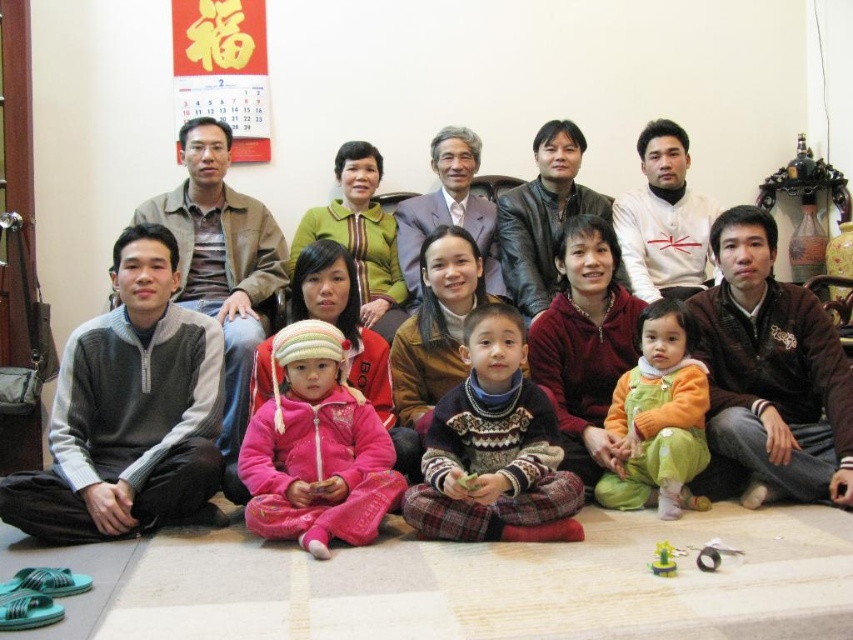
You are a photographer trying to position a small prop at the exact center of the image. You need to place it in a way that it doesn not interfere with the orange fleece onesie at lower center. Where should you place the prop?

The orange fleece onesie at lower center is located at point (657, 419). To avoid interference, place the prop away from this coordinate, perhaps at the center coordinates like (426, 320).

You are arranging a family photo where the pink fleece jacket at center and the knitted sweater at center are both in the frame. Which piece of clothing is positioned to the left?

The pink fleece jacket at center is to the left of the knitted sweater at center.